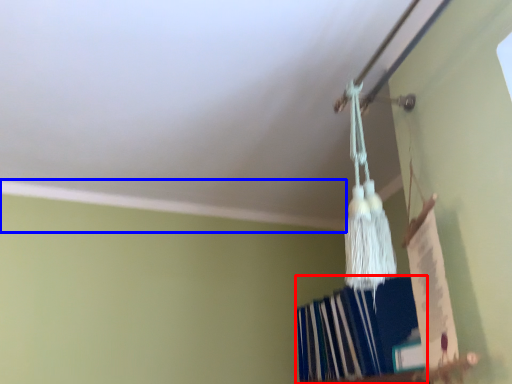
Question: Among these objects, which one is farthest to the camera, book (highlighted by a red box) or trim (highlighted by a blue box)?

Choices:
 (A) book
 (B) trim

Answer: (B)